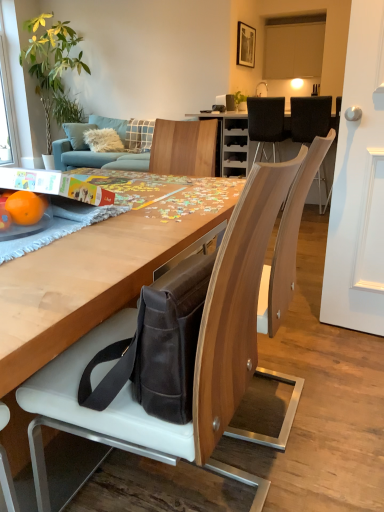
Locate an element on the screen. free point behind orangesmoothfruit at left is located at coordinates (65, 208).